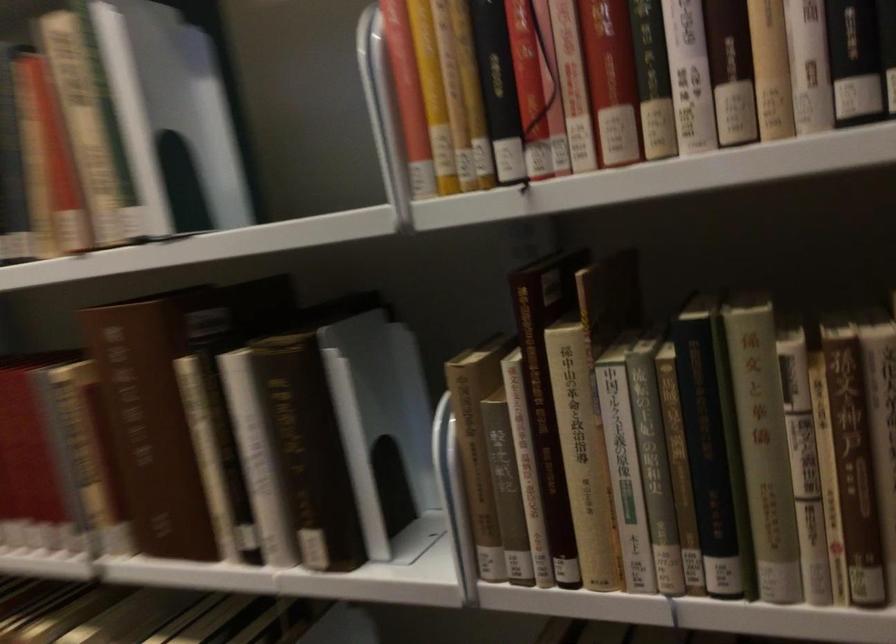
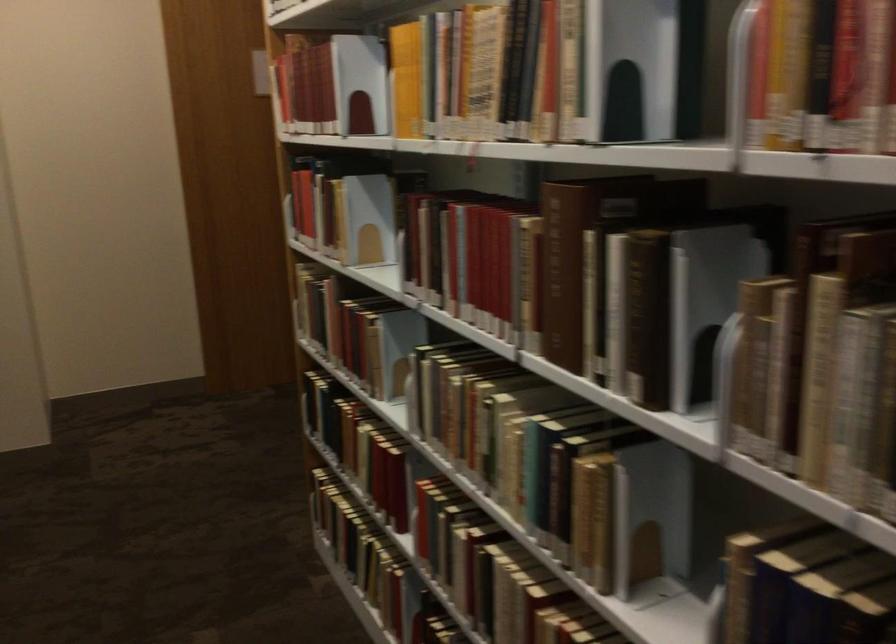
Locate, in the second image, the point that corresponds to (581,444) in the first image.

(817, 366)